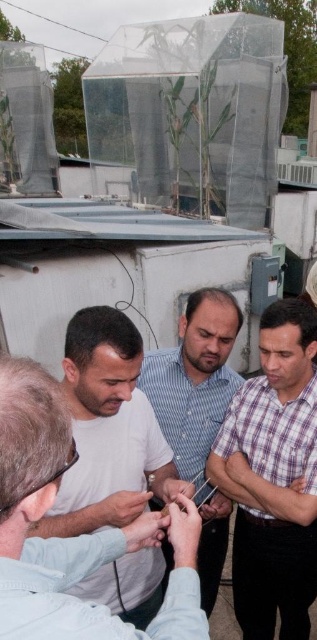
How much distance is there between white matte shirt at center and blue striped shirt at center?

The distance of white matte shirt at center from blue striped shirt at center is 18.71 inches.

Is white matte shirt at center bigger than blue striped shirt at center?

Actually, white matte shirt at center might be smaller than blue striped shirt at center.

I want to click on white matte shirt at center, so click(x=109, y=429).

At what (x,y) coordinates should I click in order to perform the action: click on white matte shirt at center. Please return your answer as a coordinate pair (x, y). The width and height of the screenshot is (317, 640). Looking at the image, I should click on (109, 429).

Can you confirm if plaid shirt at center is positioned to the right of blue striped shirt at center?

Correct, you'll find plaid shirt at center to the right of blue striped shirt at center.

Does plaid shirt at center have a smaller size compared to blue striped shirt at center?

Actually, plaid shirt at center might be larger than blue striped shirt at center.

Where is `plaid shirt at center`? plaid shirt at center is located at coordinates (273, 476).

Who is more distant from viewer, (259, 481) or (134, 365)?

The point (259, 481) is behind.

Looking at this image, does plaid shirt at center lie in front of white matte shirt at center?

No, plaid shirt at center is behind white matte shirt at center.

Is point (285, 449) farther from viewer compared to point (114, 416)?

Yes, it is behind point (114, 416).

This screenshot has height=640, width=317. Identify the location of plaid shirt at center. (273, 476).